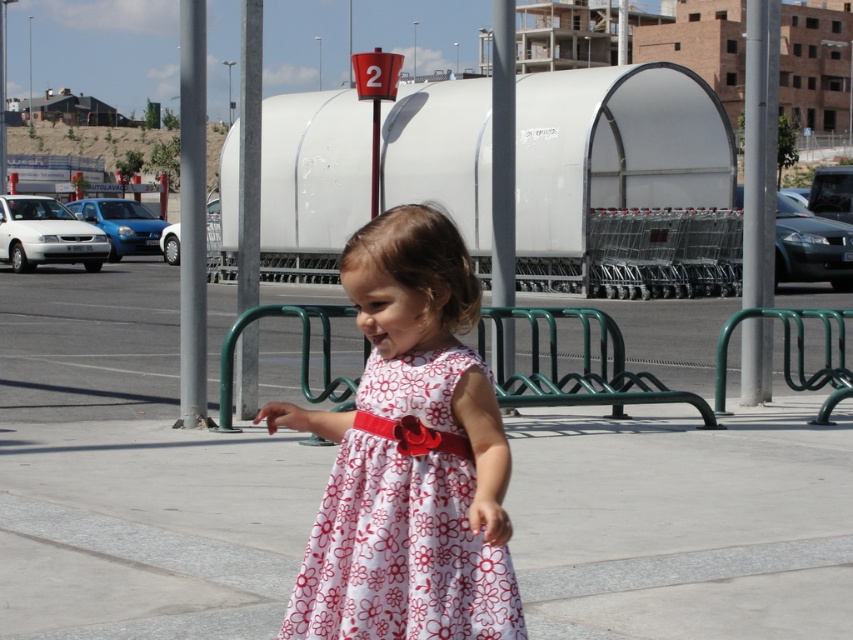
In the scene shown: You are a photographer trying to capture the floral cotton dress at center and the white concrete pavement at center in a single shot. Based on their positions, which object should you adjust your camera to focus on first to ensure both are in frame?

Since the white concrete pavement at center is to the right of the floral cotton dress at center, you should focus on the floral cotton dress at center first to ensure both are included in the frame.

You are a parent trying to carry your child wearing the floral cotton dress at center across the white concrete pavement at center. Can you walk side by side with your child without stepping off the pavement?

The white concrete pavement at center is wider than the floral cotton dress at center, so yes, you can walk side by side with your child wearing the floral cotton dress at center without stepping off the pavement.